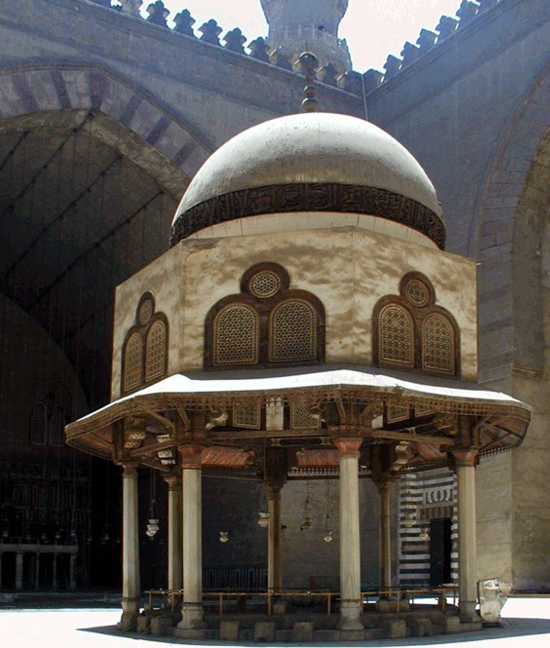
This screenshot has width=550, height=648. I want to click on arch shapes, so click(125, 354), click(152, 356), click(244, 353), click(287, 327), click(390, 332), click(442, 334).